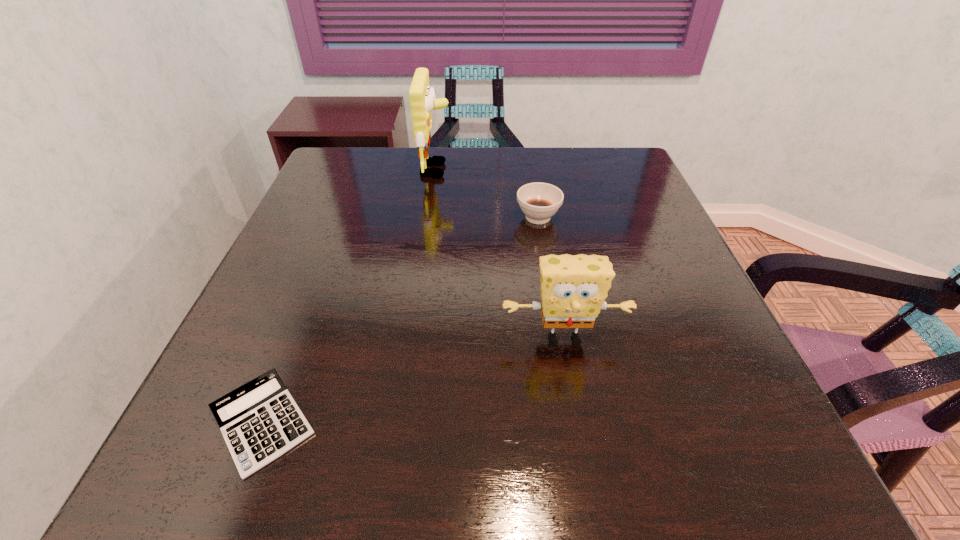
Find the location of `the farther sponge`. the farther sponge is located at coordinates (422, 96).

Find the location of a particular element. the tallest object is located at coordinates (422, 96).

You are a GUI agent. You are given a task and a screenshot of the screen. Output one action in this format:
    pyautogui.click(x=<x>, y=<y>)
    Task: Click on the second tallest object
    This screenshot has height=540, width=960.
    Given the screenshot: What is the action you would take?
    pyautogui.click(x=573, y=288)

Where is `the third farthest object`? This screenshot has width=960, height=540. the third farthest object is located at coordinates (573, 288).

Where is `soup bowl`? This screenshot has height=540, width=960. soup bowl is located at coordinates (539, 201).

Locate an element on the screen. The image size is (960, 540). the third tallest object is located at coordinates (539, 201).

Locate an element on the screen. the leftmost object is located at coordinates (260, 421).

I want to click on the shortest object, so click(260, 421).

Find the location of `vacant space located 0.050m on the face of the taller sponge`. vacant space located 0.050m on the face of the taller sponge is located at coordinates (468, 170).

The width and height of the screenshot is (960, 540). Identify the location of vacant position located on the face of the shorter sponge. (571, 381).